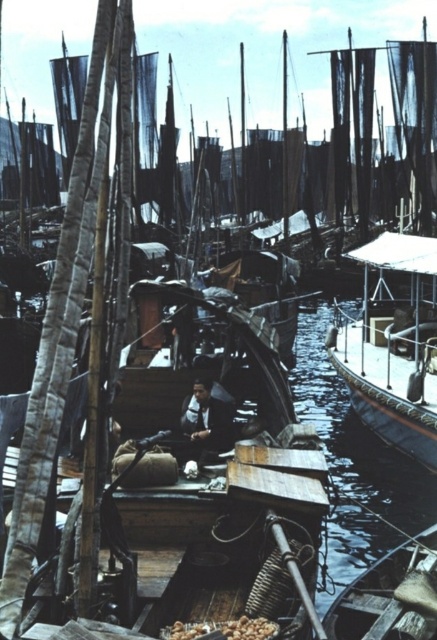
Question: Can you confirm if wooden boat at right is smaller than wooden boat at lower right?

Choices:
 (A) no
 (B) yes

Answer: (A)

Question: Which of the following is the farthest from the observer?

Choices:
 (A) tap(361, 580)
 (B) tap(374, 241)
 (C) tap(205, 403)

Answer: (B)

Question: Considering the relative positions of wooden boat at lower right and dark blue fabric at center in the image provided, where is wooden boat at lower right located with respect to dark blue fabric at center?

Choices:
 (A) right
 (B) left

Answer: (A)

Question: Which is nearer to the wooden boat at lower right?

Choices:
 (A) dark blue fabric at center
 (B) wooden boat at right

Answer: (A)

Question: Can you confirm if wooden boat at lower right is positioned to the right of dark blue fabric at center?

Choices:
 (A) no
 (B) yes

Answer: (B)

Question: Which of the following is the closest to the observer?

Choices:
 (A) (389, 408)
 (B) (211, 458)

Answer: (B)